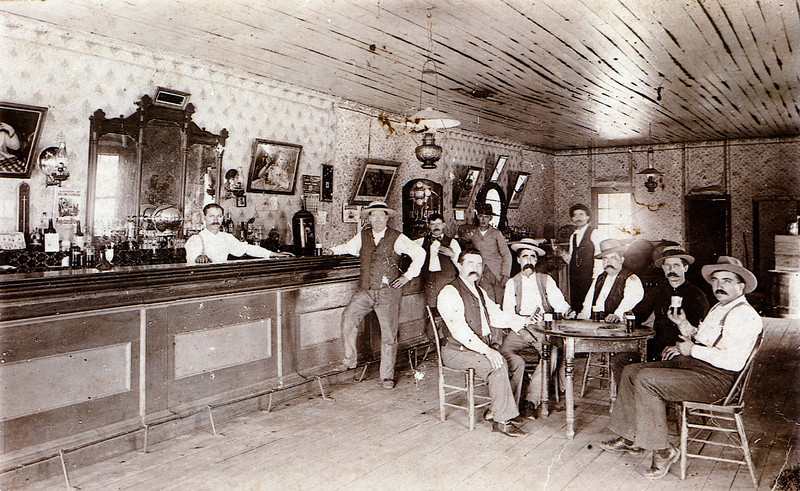
The height and width of the screenshot is (491, 800). What are the coordinates of `table` in the screenshot? It's located at (590, 336).